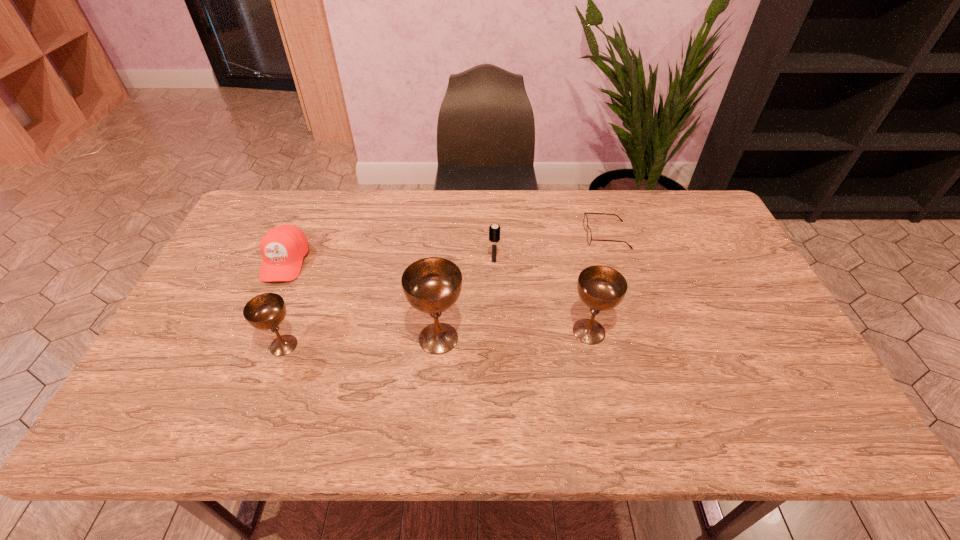
Identify the location of vacant space situated 0.070m on the back of the second tallest object. (581, 295).

Find the location of a particular element. Image resolution: width=960 pixels, height=540 pixels. free space located on the front panel of the baseball cap is located at coordinates (252, 336).

Find the location of a particular element. The width and height of the screenshot is (960, 540). vacant space located 0.360m on the right of the hairbrush is located at coordinates point(618,261).

Find the location of a particular element. The width and height of the screenshot is (960, 540). free space located 0.330m on the front-facing side of the spectacles is located at coordinates (483, 235).

Where is `vacant space situated on the front-facing side of the spectacles`? vacant space situated on the front-facing side of the spectacles is located at coordinates (520, 235).

This screenshot has width=960, height=540. I want to click on vacant space located on the front-facing side of the spectacles, so click(514, 235).

Find the location of a particular element. The image size is (960, 540). object that is at the far edge is located at coordinates point(589,236).

Image resolution: width=960 pixels, height=540 pixels. What are the coordinates of `object that is at the left edge` in the screenshot? It's located at (283, 248).

Where is `free space at the far edge`? Image resolution: width=960 pixels, height=540 pixels. free space at the far edge is located at coordinates (361, 213).

What are the coordinates of `vacant space at the near edge of the desktop` in the screenshot? It's located at (505, 373).